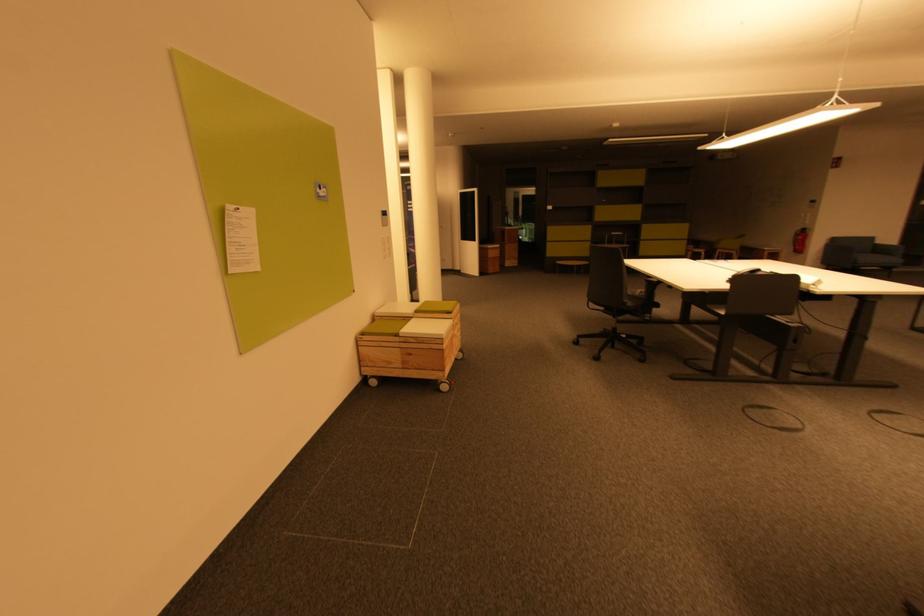
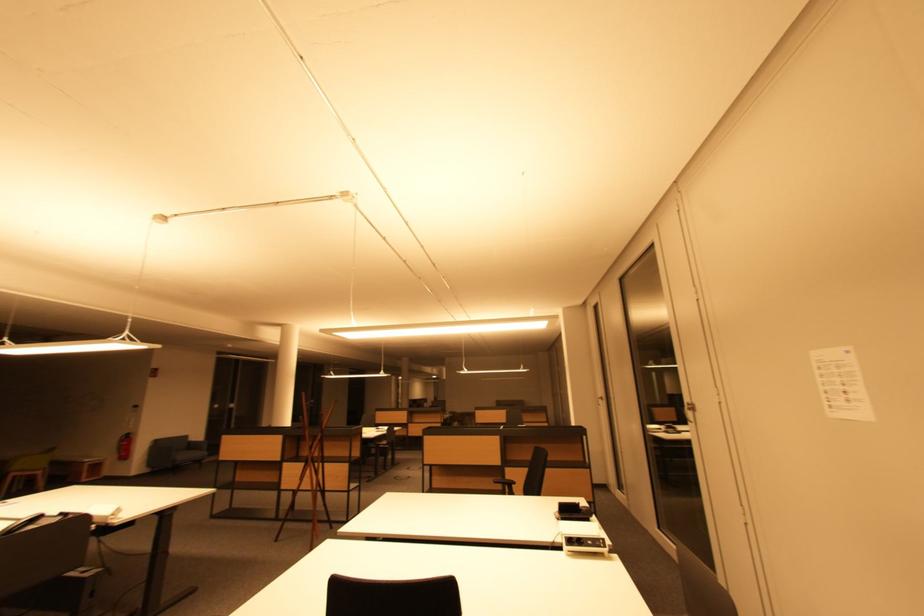
Where in the second image is the point corresponding to (x=804, y=252) from the first image?

(128, 458)